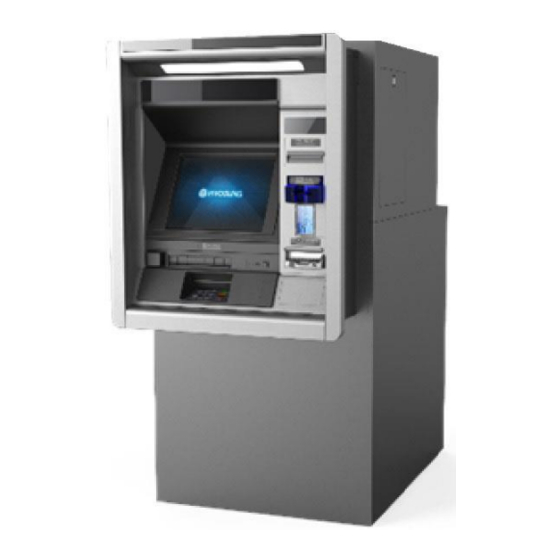
At what (x,y) coordinates should I click in order to perform the action: click on keypad. Please return your answer as a coordinate pair (x, y). The height and width of the screenshot is (560, 560). Looking at the image, I should click on (191, 287), (226, 287), (225, 300), (185, 297).